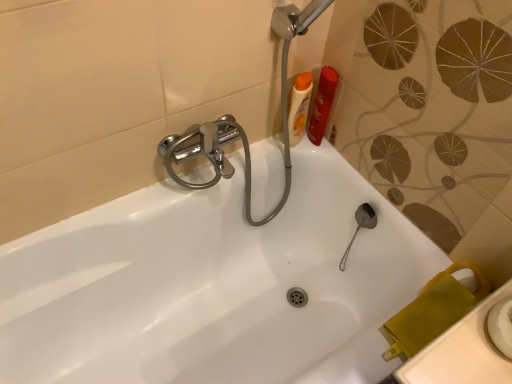
What do you see at coordinates (298, 107) in the screenshot? I see `matte plastic bottles at upper right, which is counted as the second toiletry, starting from the right` at bounding box center [298, 107].

Find the location of a particular element. This screenshot has width=512, height=384. matte plastic bottles at upper right, which is counted as the second toiletry, starting from the right is located at coordinates (298, 107).

The image size is (512, 384). What are the coordinates of `orange plastic shampoo bottle at upper right, acting as the 1th toiletry starting from the right` in the screenshot? It's located at (322, 104).

What do you see at coordinates (322, 104) in the screenshot?
I see `orange plastic shampoo bottle at upper right, marked as the 2th toiletry in a left-to-right arrangement` at bounding box center [322, 104].

In order to face orange plastic shampoo bottle at upper right, acting as the 1th toiletry starting from the right, should I rotate leftwards or rightwards?

Rotate right and turn 8.947 degrees.

What is the approximate width of orange plastic shampoo bottle at upper right, acting as the 1th toiletry starting from the right?

3.34 inches.

The width and height of the screenshot is (512, 384). Find the location of `matte plastic bottles at upper right, which is counted as the second toiletry, starting from the right`. matte plastic bottles at upper right, which is counted as the second toiletry, starting from the right is located at coordinates (298, 107).

Which is more to the right, orange plastic shampoo bottle at upper right, acting as the 1th toiletry starting from the right, or matte plastic bottles at upper right, the 1th toiletry from the left?

Positioned to the right is orange plastic shampoo bottle at upper right, acting as the 1th toiletry starting from the right.

Does orange plastic shampoo bottle at upper right, marked as the 2th toiletry in a left-to-right arrangement, come behind matte plastic bottles at upper right, which is counted as the second toiletry, starting from the right?

That is True.

Does point (310, 122) appear closer or farther from the camera than point (297, 130)?

Point (310, 122).

From the image's perspective, is orange plastic shampoo bottle at upper right, acting as the 1th toiletry starting from the right, below matte plastic bottles at upper right, the 1th toiletry from the left?

No, from the image's perspective, orange plastic shampoo bottle at upper right, acting as the 1th toiletry starting from the right, is not beneath matte plastic bottles at upper right, the 1th toiletry from the left.

From a real-world perspective, is orange plastic shampoo bottle at upper right, marked as the 2th toiletry in a left-to-right arrangement, physically located above or below matte plastic bottles at upper right, the 1th toiletry from the left?

Clearly, from a real-world perspective, orange plastic shampoo bottle at upper right, marked as the 2th toiletry in a left-to-right arrangement, is below matte plastic bottles at upper right, the 1th toiletry from the left.

Between orange plastic shampoo bottle at upper right, acting as the 1th toiletry starting from the right, and matte plastic bottles at upper right, which is counted as the second toiletry, starting from the right, which one has larger width?

Wider between the two is orange plastic shampoo bottle at upper right, acting as the 1th toiletry starting from the right.

Which of these two, orange plastic shampoo bottle at upper right, marked as the 2th toiletry in a left-to-right arrangement, or matte plastic bottles at upper right, which is counted as the second toiletry, starting from the right, stands shorter?

Standing shorter between the two is orange plastic shampoo bottle at upper right, marked as the 2th toiletry in a left-to-right arrangement.

Which of these two, orange plastic shampoo bottle at upper right, acting as the 1th toiletry starting from the right, or matte plastic bottles at upper right, which is counted as the second toiletry, starting from the right, is bigger?

matte plastic bottles at upper right, which is counted as the second toiletry, starting from the right, is bigger.

In the scene shown: Is matte plastic bottles at upper right, the 1th toiletry from the left, inside orange plastic shampoo bottle at upper right, acting as the 1th toiletry starting from the right?

That's incorrect, matte plastic bottles at upper right, the 1th toiletry from the left, is not inside orange plastic shampoo bottle at upper right, acting as the 1th toiletry starting from the right.

Are orange plastic shampoo bottle at upper right, acting as the 1th toiletry starting from the right, and matte plastic bottles at upper right, which is counted as the second toiletry, starting from the right, far apart?

orange plastic shampoo bottle at upper right, acting as the 1th toiletry starting from the right, is near matte plastic bottles at upper right, which is counted as the second toiletry, starting from the right, not far away.

Does orange plastic shampoo bottle at upper right, marked as the 2th toiletry in a left-to-right arrangement, turn towards matte plastic bottles at upper right, which is counted as the second toiletry, starting from the right?

No, orange plastic shampoo bottle at upper right, marked as the 2th toiletry in a left-to-right arrangement, is not aimed at matte plastic bottles at upper right, which is counted as the second toiletry, starting from the right.

Looking at this image, how different are the orientations of orange plastic shampoo bottle at upper right, marked as the 2th toiletry in a left-to-right arrangement, and matte plastic bottles at upper right, which is counted as the second toiletry, starting from the right, in degrees?

orange plastic shampoo bottle at upper right, marked as the 2th toiletry in a left-to-right arrangement, and matte plastic bottles at upper right, which is counted as the second toiletry, starting from the right, are facing 6.59e-05 degrees away from each other.

How far apart are orange plastic shampoo bottle at upper right, acting as the 1th toiletry starting from the right, and matte plastic bottles at upper right, which is counted as the second toiletry, starting from the right?

A distance of 1.86 inches exists between orange plastic shampoo bottle at upper right, acting as the 1th toiletry starting from the right, and matte plastic bottles at upper right, which is counted as the second toiletry, starting from the right.

Image resolution: width=512 pixels, height=384 pixels. Find the location of `toiletry in front of the orange plastic shampoo bottle at upper right, acting as the 1th toiletry starting from the right`. toiletry in front of the orange plastic shampoo bottle at upper right, acting as the 1th toiletry starting from the right is located at coordinates (298, 107).

Is matte plastic bottles at upper right, which is counted as the second toiletry, starting from the right, to the right of orange plastic shampoo bottle at upper right, marked as the 2th toiletry in a left-to-right arrangement, from the viewer's perspective?

No.

Which object is further away from the camera taking this photo, matte plastic bottles at upper right, the 1th toiletry from the left, or orange plastic shampoo bottle at upper right, acting as the 1th toiletry starting from the right?

orange plastic shampoo bottle at upper right, acting as the 1th toiletry starting from the right, is behind.

Does point (307, 75) lie behind point (313, 110)?

That is False.

From the picture: From the image's perspective, is matte plastic bottles at upper right, which is counted as the second toiletry, starting from the right, located above or below orange plastic shampoo bottle at upper right, acting as the 1th toiletry starting from the right?

Clearly, from the image's perspective, matte plastic bottles at upper right, which is counted as the second toiletry, starting from the right, is below orange plastic shampoo bottle at upper right, acting as the 1th toiletry starting from the right.

From a real-world perspective, is matte plastic bottles at upper right, the 1th toiletry from the left, beneath orange plastic shampoo bottle at upper right, marked as the 2th toiletry in a left-to-right arrangement?

No, from a real-world perspective, matte plastic bottles at upper right, the 1th toiletry from the left, is not below orange plastic shampoo bottle at upper right, marked as the 2th toiletry in a left-to-right arrangement.

Is matte plastic bottles at upper right, which is counted as the second toiletry, starting from the right, thinner than orange plastic shampoo bottle at upper right, marked as the 2th toiletry in a left-to-right arrangement?

Yes.

Does matte plastic bottles at upper right, which is counted as the second toiletry, starting from the right, have a greater height compared to orange plastic shampoo bottle at upper right, marked as the 2th toiletry in a left-to-right arrangement?

Yes, matte plastic bottles at upper right, which is counted as the second toiletry, starting from the right, is taller than orange plastic shampoo bottle at upper right, marked as the 2th toiletry in a left-to-right arrangement.

Is matte plastic bottles at upper right, which is counted as the second toiletry, starting from the right, smaller than orange plastic shampoo bottle at upper right, marked as the 2th toiletry in a left-to-right arrangement?

Incorrect, matte plastic bottles at upper right, which is counted as the second toiletry, starting from the right, is not smaller in size than orange plastic shampoo bottle at upper right, marked as the 2th toiletry in a left-to-right arrangement.

Is orange plastic shampoo bottle at upper right, marked as the 2th toiletry in a left-to-right arrangement, surrounded by matte plastic bottles at upper right, the 1th toiletry from the left?

That's incorrect, orange plastic shampoo bottle at upper right, marked as the 2th toiletry in a left-to-right arrangement, is not inside matte plastic bottles at upper right, the 1th toiletry from the left.

Would you consider matte plastic bottles at upper right, the 1th toiletry from the left, to be distant from orange plastic shampoo bottle at upper right, acting as the 1th toiletry starting from the right?

No, matte plastic bottles at upper right, the 1th toiletry from the left, is not far away from orange plastic shampoo bottle at upper right, acting as the 1th toiletry starting from the right.

Is matte plastic bottles at upper right, the 1th toiletry from the left, positioned with its back to orange plastic shampoo bottle at upper right, acting as the 1th toiletry starting from the right?

No, matte plastic bottles at upper right, the 1th toiletry from the left, is not facing away from orange plastic shampoo bottle at upper right, acting as the 1th toiletry starting from the right.

The height and width of the screenshot is (384, 512). Find the location of `toiletry in front of the orange plastic shampoo bottle at upper right, acting as the 1th toiletry starting from the right`. toiletry in front of the orange plastic shampoo bottle at upper right, acting as the 1th toiletry starting from the right is located at coordinates (298, 107).

The image size is (512, 384). Identify the location of toiletry on the right of matte plastic bottles at upper right, the 1th toiletry from the left. (322, 104).

This screenshot has height=384, width=512. Find the location of `toiletry below the matte plastic bottles at upper right, the 1th toiletry from the left (from a real-world perspective)`. toiletry below the matte plastic bottles at upper right, the 1th toiletry from the left (from a real-world perspective) is located at coordinates (322, 104).